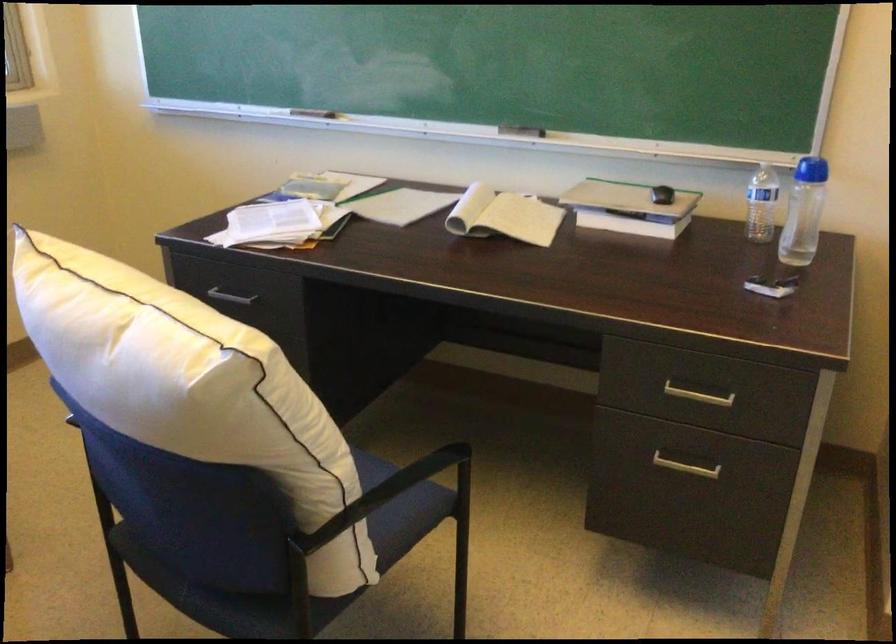
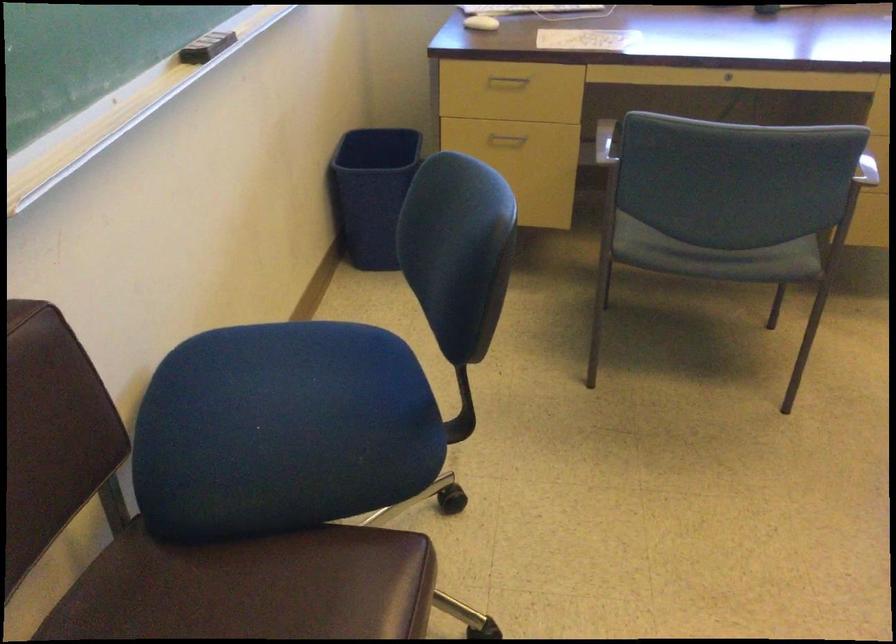
How did the camera likely rotate?

The camera rotated toward left-down.